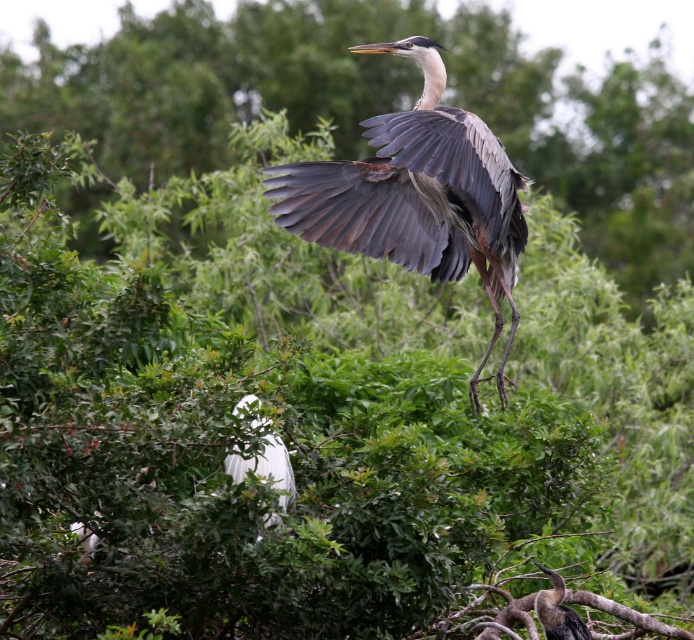
Question: Which of the following is the closest to the observer?

Choices:
 (A) (577, 637)
 (B) (273, 486)
 (C) (459, 273)

Answer: (B)

Question: From the image, what is the correct spatial relationship of gray feathered heron at center in relation to white feathered bird at center?

Choices:
 (A) right
 (B) left

Answer: (A)

Question: Can you confirm if white feathered bird at center is positioned to the right of dark brown feathers at center?

Choices:
 (A) yes
 (B) no

Answer: (B)

Question: Which point is closer to the camera?

Choices:
 (A) white feathered bird at center
 (B) dark brown feathers at center
 (C) gray feathered heron at center

Answer: (A)

Question: Which object appears closest to the camera in this image?

Choices:
 (A) white feathered bird at center
 (B) dark brown feathers at center
 (C) gray feathered heron at center

Answer: (A)

Question: Is gray feathered heron at center closer to the viewer compared to dark brown feathers at center?

Choices:
 (A) no
 (B) yes

Answer: (A)